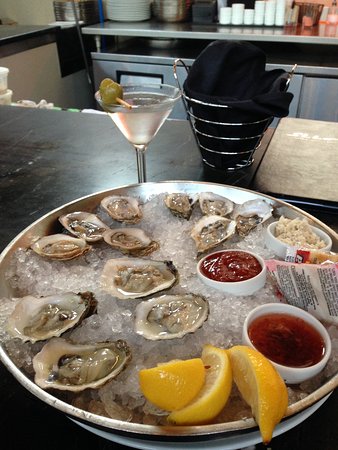
Where is `table`? This screenshot has height=450, width=338. table is located at coordinates (57, 157).